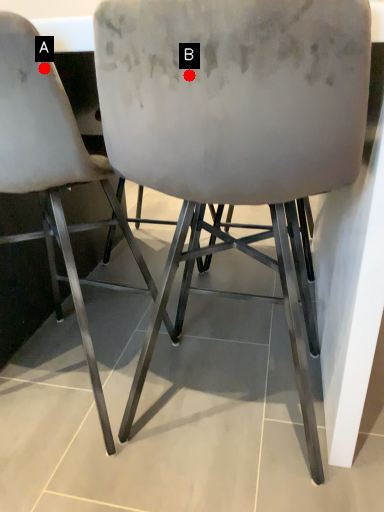
Question: Two points are circled on the image, labeled by A and B beside each circle. Which point is closer to the camera?

Choices:
 (A) A is closer
 (B) B is closer

Answer: (B)